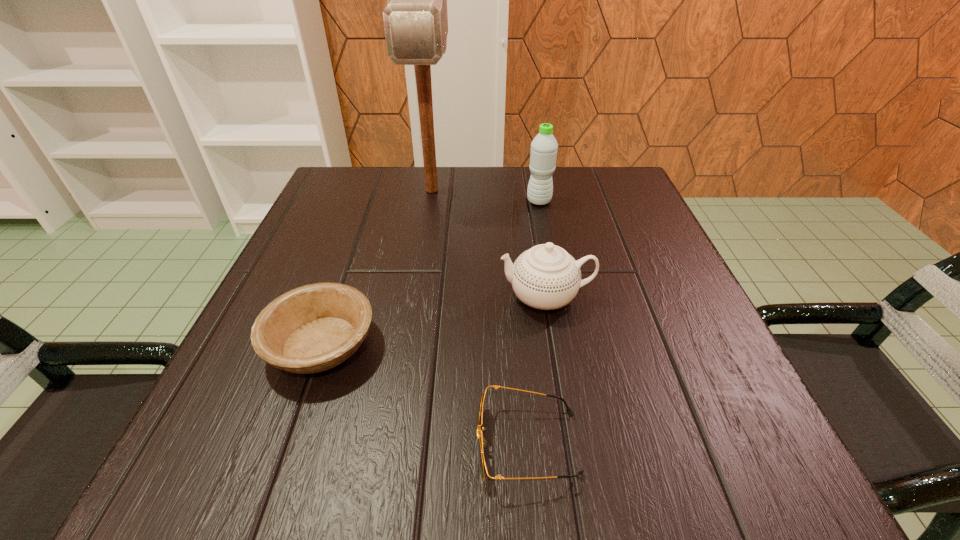
The height and width of the screenshot is (540, 960). I want to click on vacant point located between the nearest object and the fourth object from right to left, so click(x=480, y=317).

Where is `free space between the second object from left to right and the third tallest object`? Image resolution: width=960 pixels, height=540 pixels. free space between the second object from left to right and the third tallest object is located at coordinates (489, 244).

This screenshot has height=540, width=960. I want to click on blank region between the fourth tallest object and the mallet, so [x=376, y=268].

Locate an element on the screen. free space between the shortest object and the second tallest object is located at coordinates (533, 323).

The image size is (960, 540). I want to click on vacant area that lies between the sunglasses and the water bottle, so click(533, 323).

The width and height of the screenshot is (960, 540). What are the coordinates of `object that is the third closest to the nearest object` in the screenshot? It's located at [x=415, y=20].

Select which object appears as the third closest to the chinaware. Please provide its 2D coordinates. Your answer should be formatted as a tuple, i.e. [(x, y)], where the tuple contains the x and y coordinates of a point satisfying the conditions above.

[(415, 20)]

Locate an element on the screen. The width and height of the screenshot is (960, 540). blank space that satisfies the following two spatial constraints: 1. on the back side of the second shortest object; 2. on the right side of the second tallest object is located at coordinates (372, 201).

The image size is (960, 540). In order to click on vacant region that satisfies the following two spatial constraints: 1. on the striking face of the mallet; 2. on the right side of the second tallest object in this screenshot , I will do 430,201.

In order to click on free space in the image that satisfies the following two spatial constraints: 1. on the striking face of the mallet; 2. on the right side of the water bottle in this screenshot , I will do `click(430, 201)`.